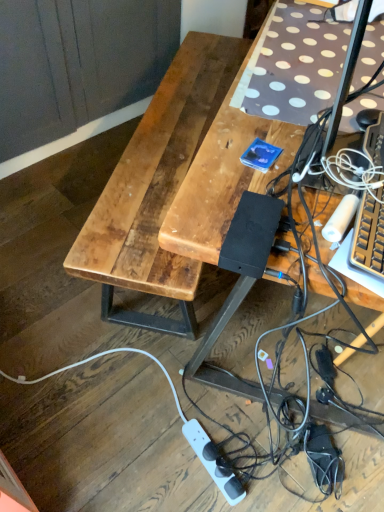
Where is `vacant area that lies in front of white plastic power strip at lower center`? The width and height of the screenshot is (384, 512). vacant area that lies in front of white plastic power strip at lower center is located at coordinates (196, 495).